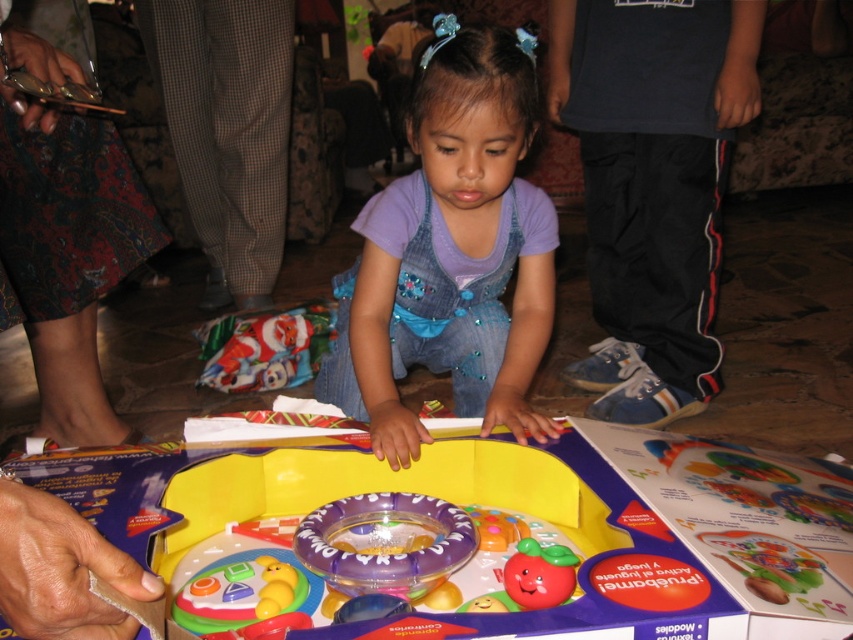
In the scene shown: You are a parent trying to locate your child in a room. You see the point at coordinates [451,252]. What object is located at that point?

The point at coordinates [451,252] marks the denim overalls at center.

You are a parent trying to tidy up the play area. You see the printed fabric skirt at lower left and the rubber apple at center. Which object is taller and needs to be moved first to avoid toppling?

The printed fabric skirt at lower left is much taller than the rubber apple at center, so it needs to be moved first to prevent it from toppling over.

You are a parent trying to organize the toys in the image. The plastic toy at center is currently at point (492, 532). If you want to move it to the edge of the play area, which direction should you move it?

The plastic toy at center is currently at point (492, 532). To move it to the edge of the play area, you should move it towards the outer boundary away from the center position.